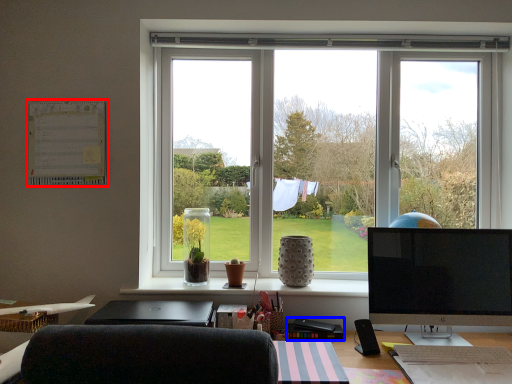
Question: Among these objects, which one is farthest to the camera, bulletin board (highlighted by a red box) or stationery (highlighted by a blue box)?

Choices:
 (A) bulletin board
 (B) stationery

Answer: (A)